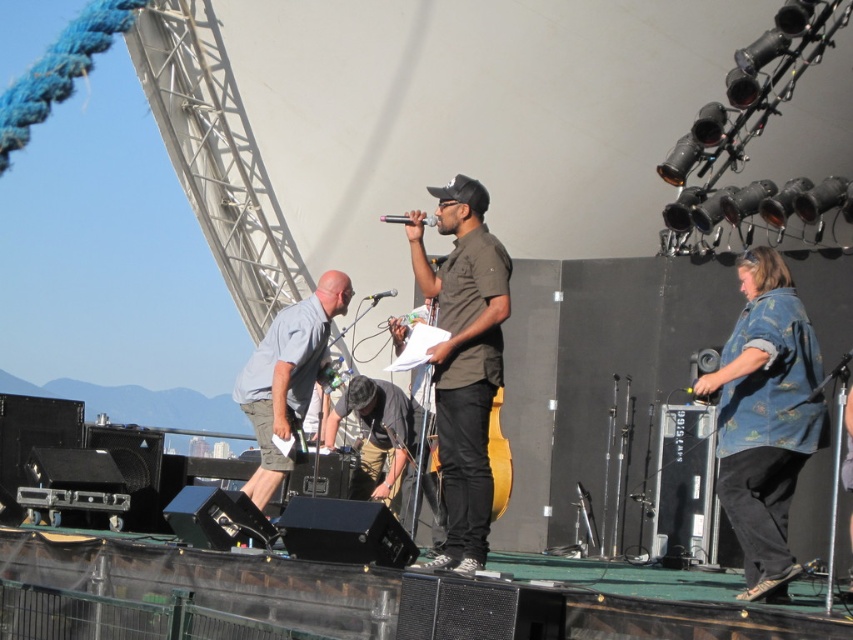
You are standing in front of the outdoor stage and want to determine which of the two points, point [462,250] or point [399,216], is closer to you. Which one is nearer?

Point [462,250] is closer to the viewer than point [399,216].

In the live performance scene under the tent, you notice two performers at the center wearing shirts labeled as dark brown shirt at center and gray fabric shirt at center. From the audience perspective, which shirt is visible first?

The dark brown shirt at center is in front of the gray fabric shirt at center, so it is the first visible from the audience perspective.